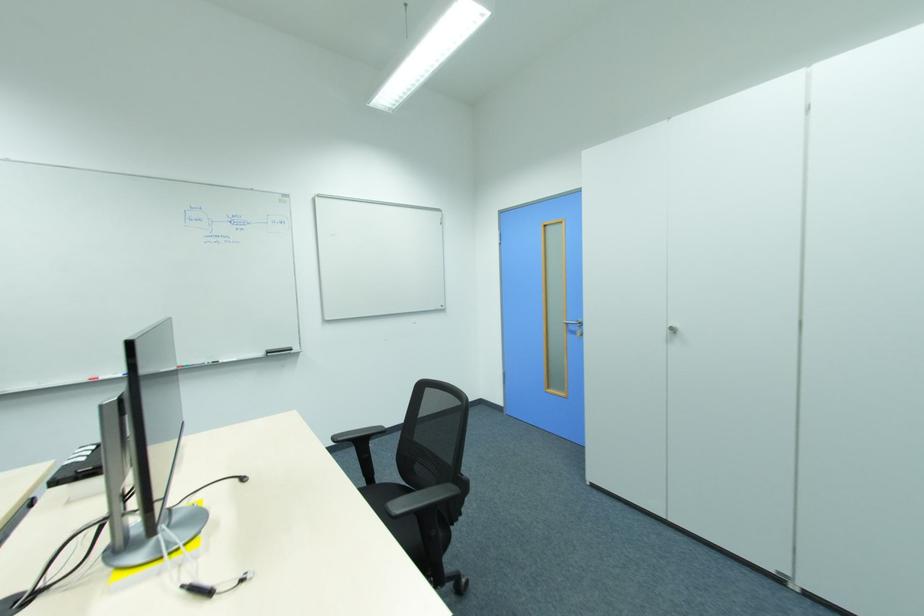
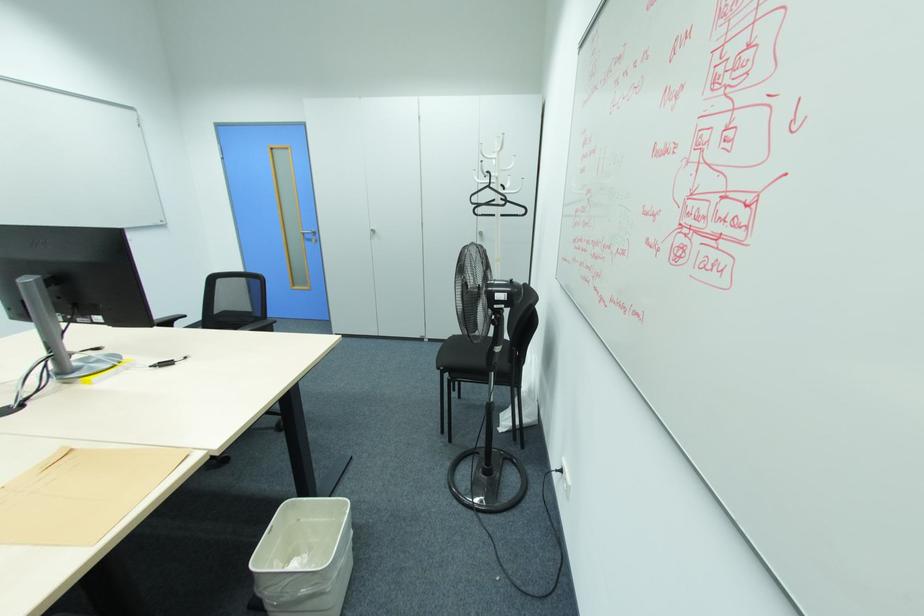
The point at (x=581, y=323) is marked in the first image. Where is the corresponding point in the second image?

(314, 233)